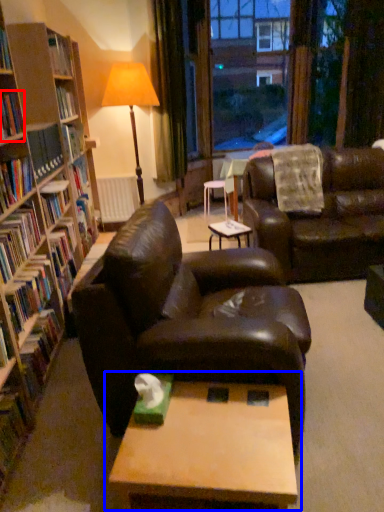
Question: Which point is closer to the camera, book (highlighted by a red box) or table (highlighted by a blue box)?

Choices:
 (A) book
 (B) table

Answer: (B)